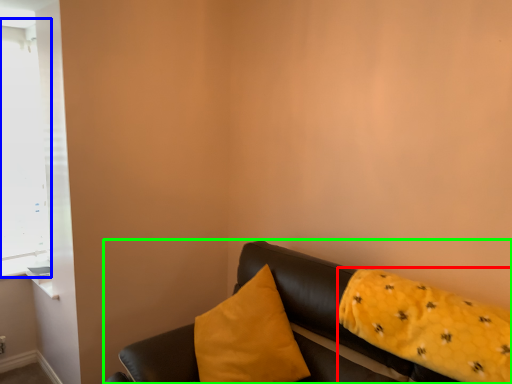
Question: Considering the real-world distances, which object is farthest from pillow (highlighted by a red box)? window (highlighted by a blue box) or studio couch (highlighted by a green box)?

Choices:
 (A) window
 (B) studio couch

Answer: (A)